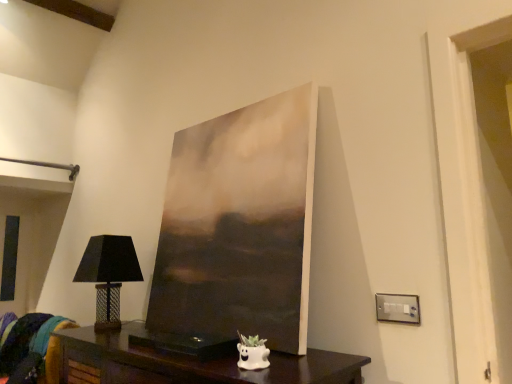
Question: From the image's perspective, is dark wood table at lower center beneath satin silver switchplate at lower right?

Choices:
 (A) yes
 (B) no

Answer: (A)

Question: Is dark wood table at lower center facing away from satin silver switchplate at lower right?

Choices:
 (A) no
 (B) yes

Answer: (A)

Question: Considering the relative positions of dark wood table at lower center and satin silver switchplate at lower right in the image provided, is dark wood table at lower center to the left of satin silver switchplate at lower right from the viewer's perspective?

Choices:
 (A) yes
 (B) no

Answer: (A)

Question: Could you tell me if dark wood table at lower center is facing satin silver switchplate at lower right?

Choices:
 (A) no
 (B) yes

Answer: (A)

Question: From a real-world perspective, is dark wood table at lower center beneath satin silver switchplate at lower right?

Choices:
 (A) no
 (B) yes

Answer: (B)

Question: From a real-world perspective, is velvet teal cushion at lower left physically located above or below matte black lampshade at left?

Choices:
 (A) below
 (B) above

Answer: (A)

Question: Looking at their shapes, would you say velvet teal cushion at lower left is wider or thinner than matte black lampshade at left?

Choices:
 (A) wide
 (B) thin

Answer: (A)

Question: In terms of size, does velvet teal cushion at lower left appear bigger or smaller than matte black lampshade at left?

Choices:
 (A) big
 (B) small

Answer: (A)

Question: Considering the relative positions of velvet teal cushion at lower left and matte black lampshade at left in the image provided, is velvet teal cushion at lower left to the left or to the right of matte black lampshade at left?

Choices:
 (A) right
 (B) left

Answer: (B)

Question: Is satin silver switchplate at lower right to the left or to the right of matte black lampshade at left in the image?

Choices:
 (A) left
 (B) right

Answer: (B)

Question: From the image's perspective, is satin silver switchplate at lower right above or below matte black lampshade at left?

Choices:
 (A) below
 (B) above

Answer: (B)

Question: In terms of height, does satin silver switchplate at lower right look taller or shorter compared to matte black lampshade at left?

Choices:
 (A) short
 (B) tall

Answer: (A)

Question: Considering the positions of point (390, 296) and point (134, 266), is point (390, 296) closer or farther from the camera than point (134, 266)?

Choices:
 (A) farther
 (B) closer

Answer: (B)

Question: Does point (348, 354) appear closer or farther from the camera than point (390, 304)?

Choices:
 (A) closer
 (B) farther

Answer: (B)

Question: From a real-world perspective, is dark wood table at lower center above or below satin silver switchplate at lower right?

Choices:
 (A) below
 (B) above

Answer: (A)